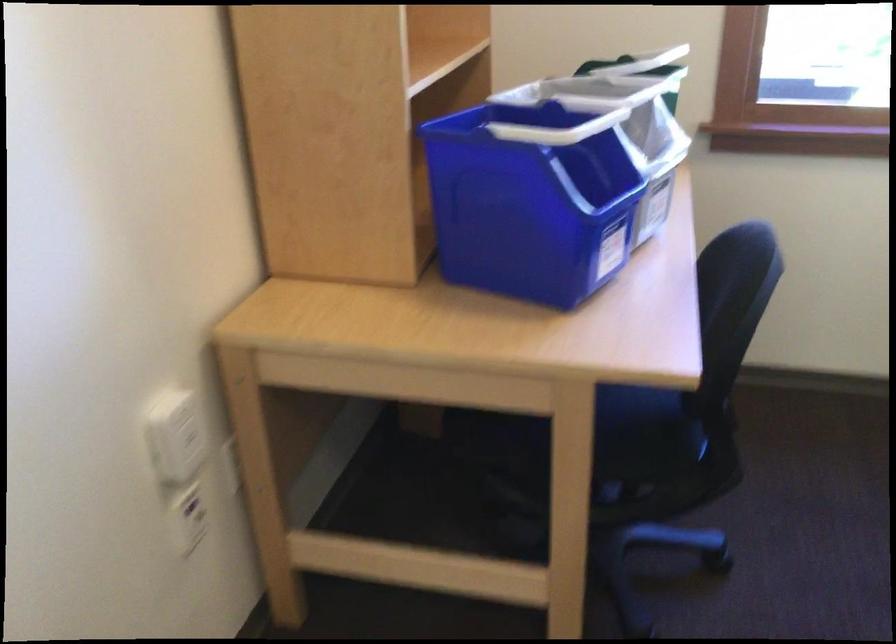
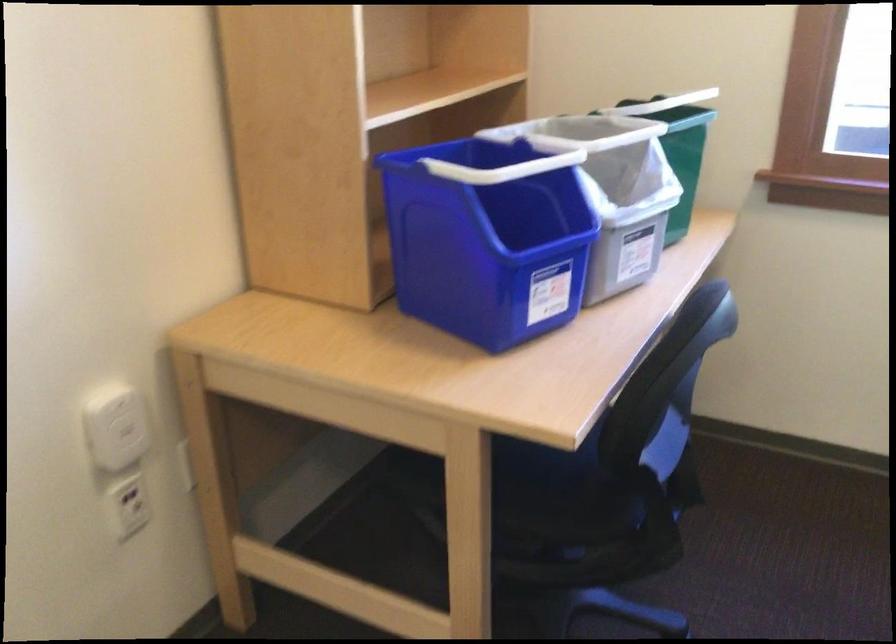
Question: The images are taken continuously from a first-person perspective. In which direction are you moving?

Choices:
 (A) Left
 (B) Right
 (C) Forward
 (D) Backward

Answer: (B)